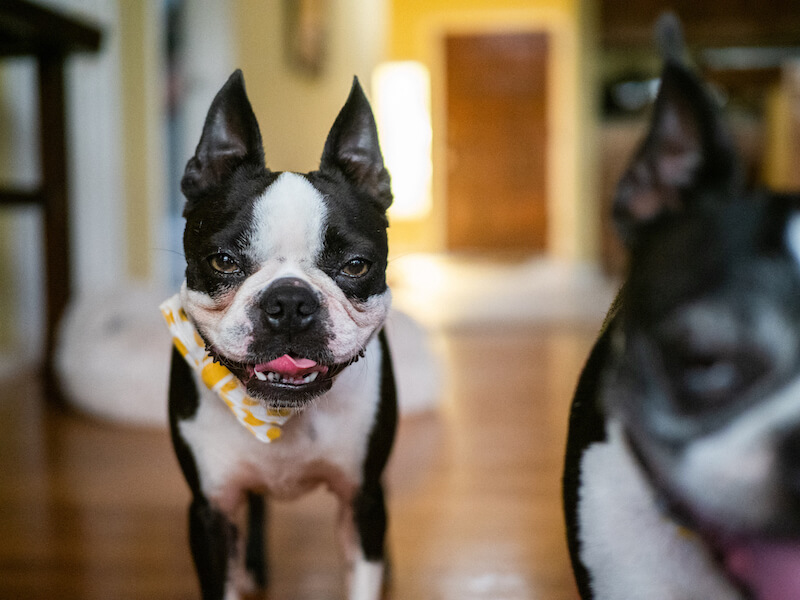
The image size is (800, 600). Identify the location of light. [x=392, y=91], [x=400, y=165].